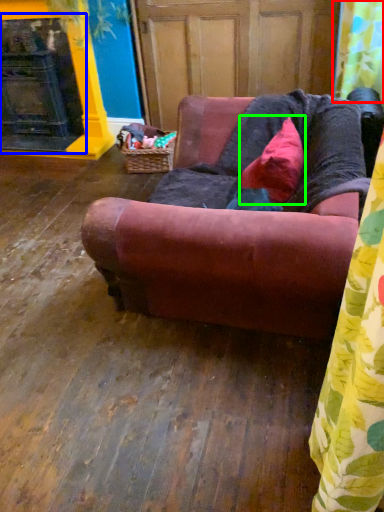
Question: Which object is positioned closest to shower curtain (highlighted by a red box)? Select from fireplace (highlighted by a blue box) and pillow (highlighted by a green box).

Choices:
 (A) fireplace
 (B) pillow

Answer: (B)